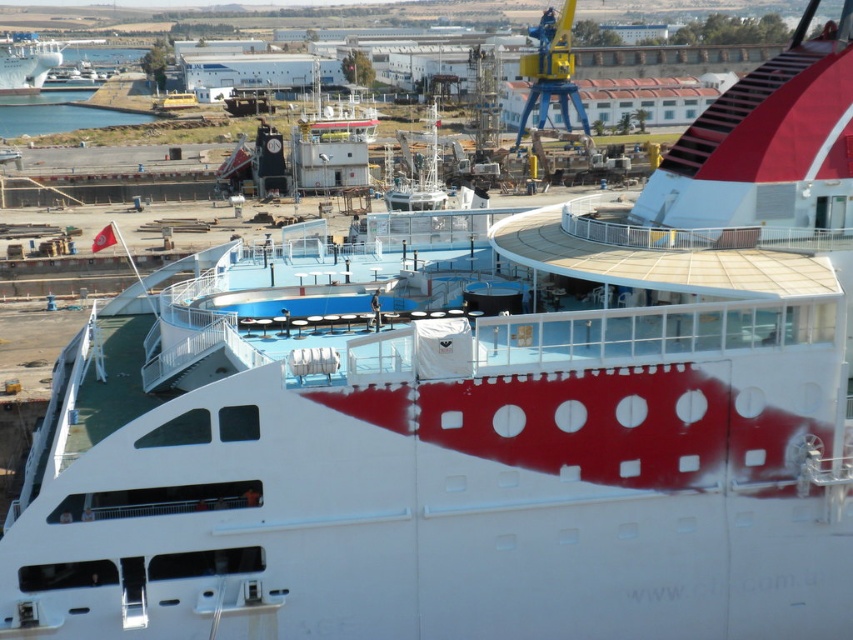
Is point (91, 122) farther from viewer compared to point (0, 51)?

No.

Is blue water at lower left to the right of white glossy ship at upper left from the viewer's perspective?

→ Indeed, blue water at lower left is positioned on the right side of white glossy ship at upper left.

Is point (35, 108) in front of point (38, 61)?

Yes, point (35, 108) is in front of point (38, 61).

At what (x,y) coordinates should I click in order to perform the action: click on blue water at lower left. Please return your answer as a coordinate pair (x, y). Looking at the image, I should click on (59, 115).